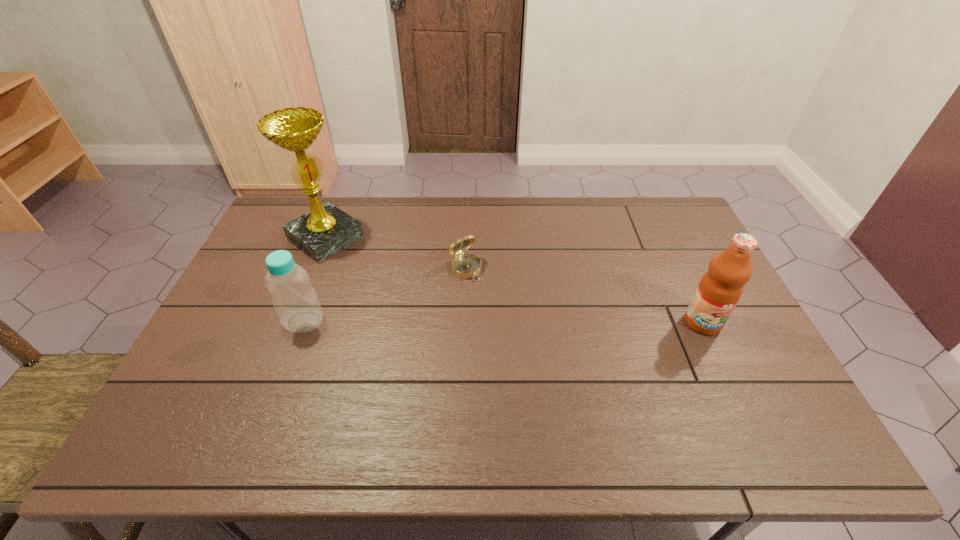
At what (x,y) coordinates should I click in order to perform the action: click on vacant space located with the dial facing the compass. Please return your answer as a coordinate pair (x, y). This screenshot has height=540, width=960. Looking at the image, I should click on (488, 296).

Locate an element on the screen. Image resolution: width=960 pixels, height=540 pixels. vacant space situated 0.360m on the front-facing side of the award is located at coordinates (425, 308).

Find the location of a particular element. free space located 0.340m on the front-facing side of the award is located at coordinates (420, 305).

Find the location of `free location located on the front-facing side of the award`. free location located on the front-facing side of the award is located at coordinates (394, 286).

Identify the location of object at the far edge. This screenshot has width=960, height=540. (325, 230).

Find the location of a particular element. object present at the left edge is located at coordinates (325, 230).

This screenshot has height=540, width=960. Identify the location of object positioned at the right edge. (719, 290).

Image resolution: width=960 pixels, height=540 pixels. Identify the location of object present at the far left corner. (325, 230).

Locate an element on the screen. vacant space at the far edge of the desktop is located at coordinates (541, 210).

Find the location of a particular element. vacant space at the left edge is located at coordinates 259,246.